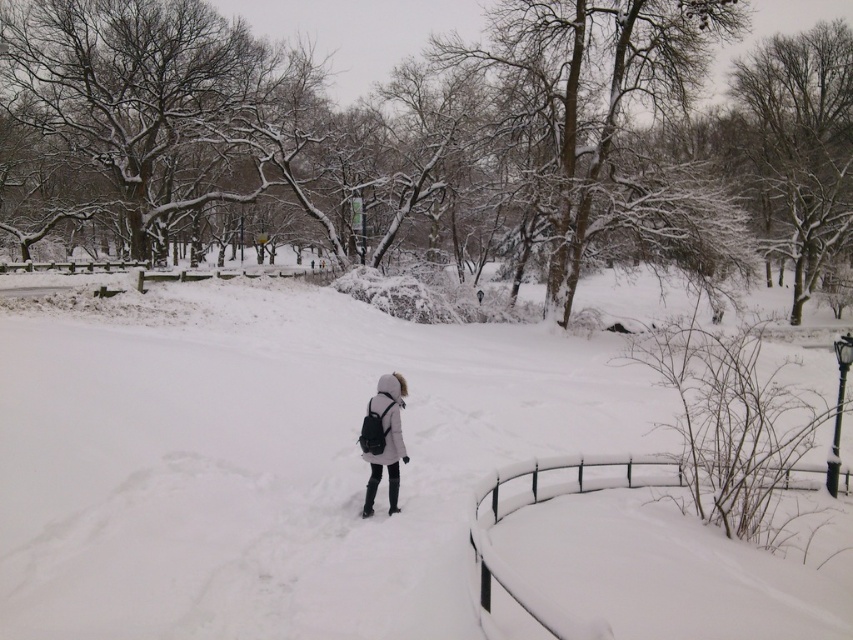
Between white fluffy snow at center and white matte coat at center, which one appears on the left side from the viewer's perspective?

white fluffy snow at center

Consider the image. Is white fluffy snow at center thinner than white matte coat at center?

Incorrect, white fluffy snow at center's width is not less than white matte coat at center's.

This screenshot has height=640, width=853. Describe the element at coordinates (270, 458) in the screenshot. I see `white fluffy snow at center` at that location.

Where is `white fluffy snow at center`? white fluffy snow at center is located at coordinates (270, 458).